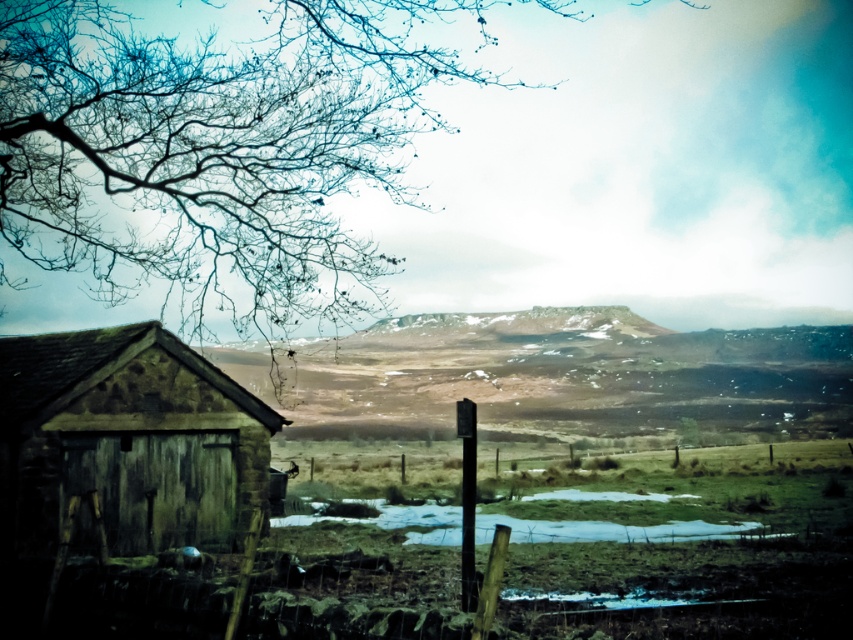
Question: Which point is closer to the camera?

Choices:
 (A) snowy rock formation at center
 (B) bare branches at upper left

Answer: (B)

Question: Which of the following is the farthest from the observer?

Choices:
 (A) rustic wooden hut at left
 (B) bare branches at upper left
 (C) snowy rock formation at center

Answer: (C)

Question: Is snowy rock formation at center bigger than rustic wooden hut at left?

Choices:
 (A) no
 (B) yes

Answer: (B)

Question: Considering the relative positions of snowy rock formation at center and rustic wooden hut at left in the image provided, where is snowy rock formation at center located with respect to rustic wooden hut at left?

Choices:
 (A) below
 (B) above

Answer: (A)

Question: Does bare branches at upper left appear on the left side of rustic wooden hut at left?

Choices:
 (A) yes
 (B) no

Answer: (A)

Question: Which object appears closest to the camera in this image?

Choices:
 (A) snowy rock formation at center
 (B) rustic wooden hut at left
 (C) bare branches at upper left

Answer: (B)